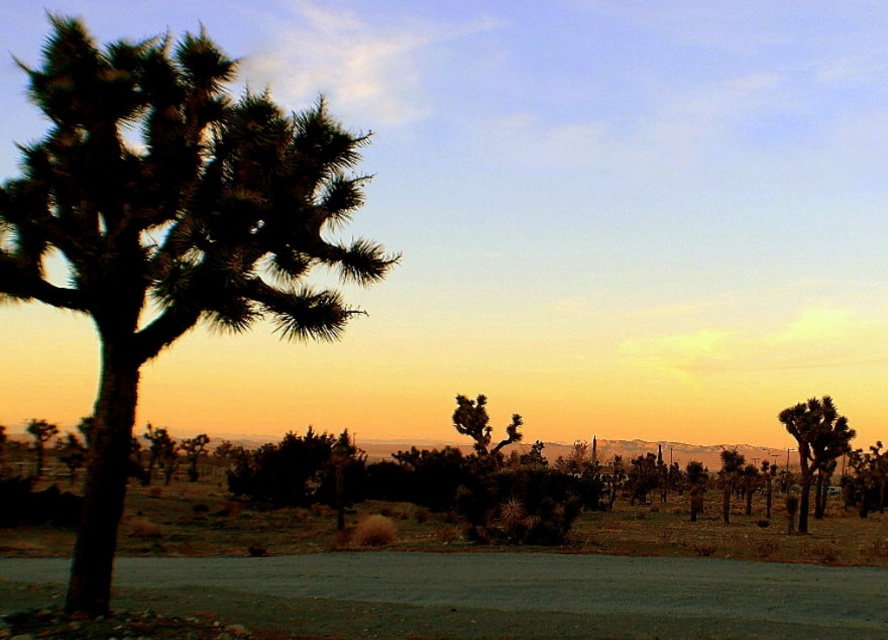
Question: Does green spiky palm tree at left appear on the left side of green spiky tree at center?

Choices:
 (A) no
 (B) yes

Answer: (B)

Question: Considering the relative positions of green spiky palm tree at left and green spiky palm tree at right in the image provided, where is green spiky palm tree at left located with respect to green spiky palm tree at right?

Choices:
 (A) above
 (B) below

Answer: (A)

Question: Estimate the real-world distances between objects in this image. Which object is farther from the green spiky tree at center?

Choices:
 (A) green spiky palm tree at right
 (B) green spiky palm tree at left

Answer: (B)

Question: Which point is closer to the camera?

Choices:
 (A) (514, 435)
 (B) (837, 454)

Answer: (B)

Question: Does green spiky palm tree at left lie in front of green spiky palm tree at right?

Choices:
 (A) no
 (B) yes

Answer: (B)

Question: Which of the following is the closest to the observer?

Choices:
 (A) green spiky tree at center
 (B) green spiky palm tree at left
 (C) green spiky palm tree at right

Answer: (B)